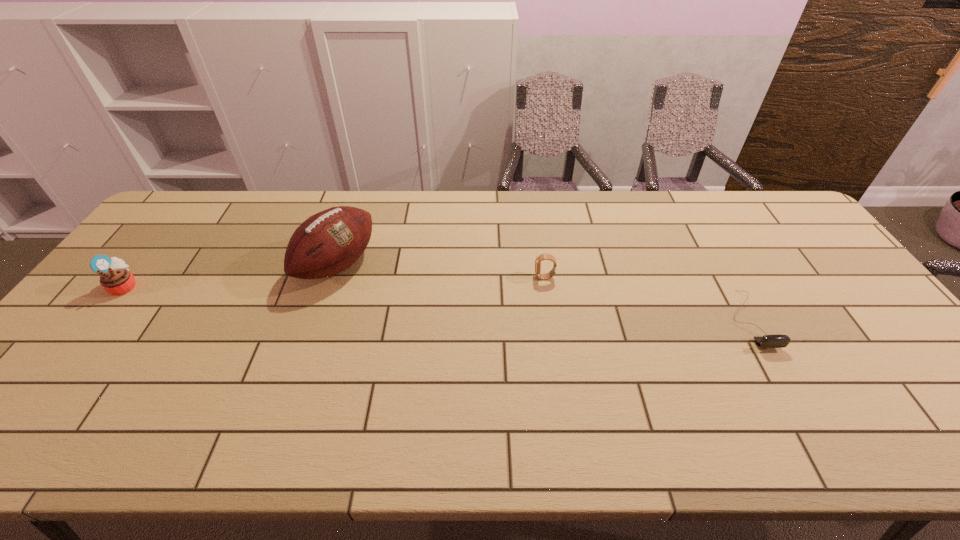
This screenshot has width=960, height=540. I want to click on vacant area located 0.080m on the face of the third tallest object, so click(x=507, y=278).

You are a GUI agent. You are given a task and a screenshot of the screen. Output one action in this format:
    pyautogui.click(x=<x>, y=<y>)
    Task: Click on the vacant area situated on the face of the third tallest object
    The image size is (960, 540).
    Given the screenshot: What is the action you would take?
    pyautogui.click(x=480, y=278)

Where is `vacant region located on the face of the third tallest object`? vacant region located on the face of the third tallest object is located at coordinates (469, 278).

This screenshot has height=540, width=960. I want to click on vacant point located 0.110m on the front-facing side of the webcam, so click(788, 391).

Where is `object located at the left edge`? This screenshot has width=960, height=540. object located at the left edge is located at coordinates (116, 279).

Where is `free region at the far edge`? This screenshot has width=960, height=540. free region at the far edge is located at coordinates (229, 200).

The height and width of the screenshot is (540, 960). I want to click on vacant space at the near edge, so click(452, 455).

Where is `vacant space at the left edge`? The width and height of the screenshot is (960, 540). vacant space at the left edge is located at coordinates (161, 239).

This screenshot has width=960, height=540. Find the location of `free space at the right edge`. free space at the right edge is located at coordinates (830, 274).

Where is `blank space at the far left corner of the desktop`? blank space at the far left corner of the desktop is located at coordinates (195, 192).